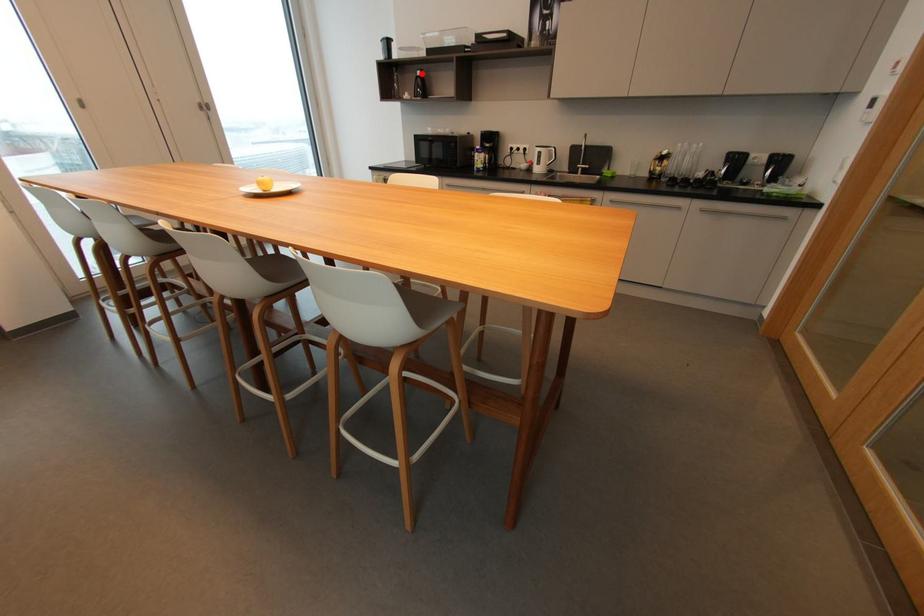
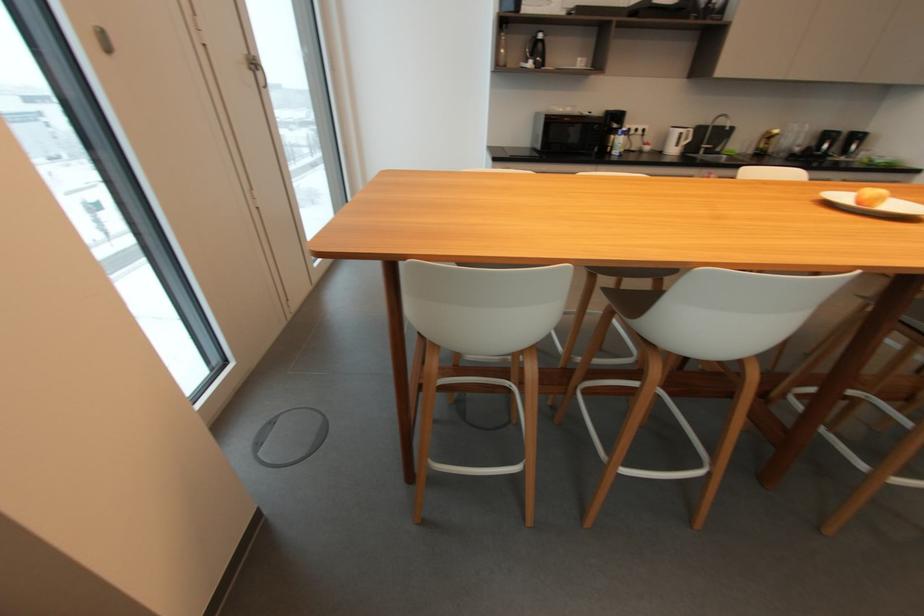
In the second image, find the point that corresponds to the highlighted location in the first image.

(544, 36)